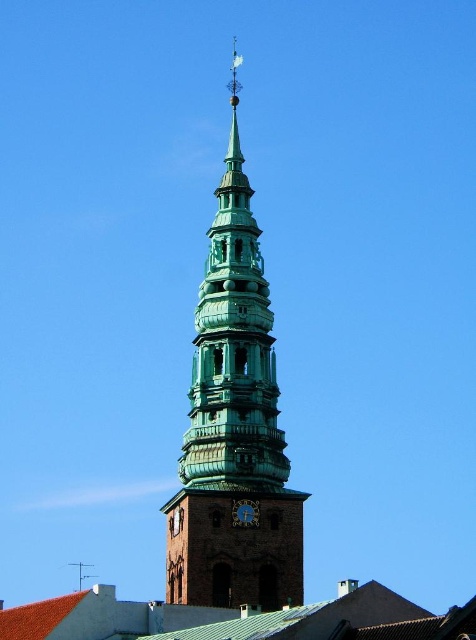
Which is above, green patinated metal tower at center or blue metallic clock at center?

green patinated metal tower at center is higher up.

Between green patinated metal tower at center and blue metallic clock at center, which one appears on the right side from the viewer's perspective?

blue metallic clock at center

Does point (195, 365) come behind point (257, 518)?

Yes, point (195, 365) is behind point (257, 518).

At what (x,y) coordinates should I click in order to perform the action: click on green patinated metal tower at center. Please return your answer as a coordinate pair (x, y). The width and height of the screenshot is (476, 640). Looking at the image, I should click on (234, 426).